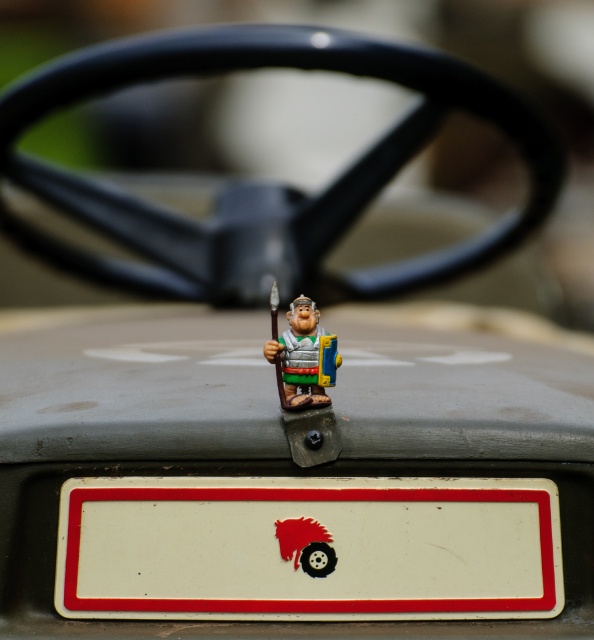
Question: Which point is closer to the camera?

Choices:
 (A) (372, 580)
 (B) (311, 362)

Answer: (A)

Question: Does white plastic license plate at center appear under matte plastic figurine at center?

Choices:
 (A) no
 (B) yes

Answer: (B)

Question: Does white plastic license plate at center appear under matte plastic figurine at center?

Choices:
 (A) yes
 (B) no

Answer: (A)

Question: Can you confirm if white plastic license plate at center is positioned to the right of matte plastic figurine at center?

Choices:
 (A) no
 (B) yes

Answer: (B)

Question: Among these objects, which one is farthest from the camera?

Choices:
 (A) white plastic license plate at center
 (B) matte plastic figurine at center

Answer: (A)

Question: Among these objects, which one is farthest from the camera?

Choices:
 (A) matte plastic figurine at center
 (B) white plastic license plate at center

Answer: (B)